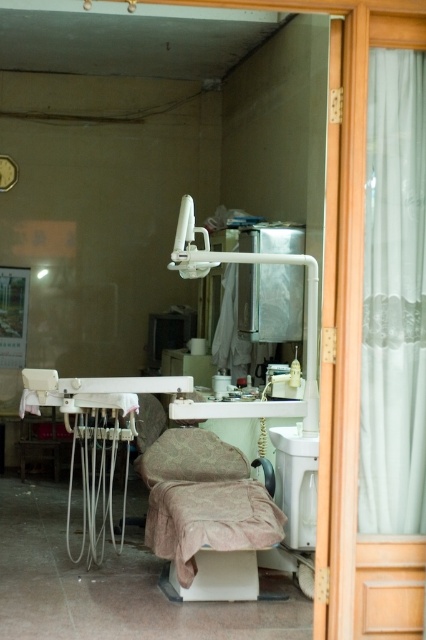
Question: Which object is farther from the camera taking this photo?

Choices:
 (A) white sheer curtain at right
 (B) pink fabric-covered chair at center

Answer: (B)

Question: Does white sheer curtain at right appear on the left side of pink fabric-covered chair at center?

Choices:
 (A) yes
 (B) no

Answer: (B)

Question: Which of the following is the farthest from the observer?

Choices:
 (A) pink fabric-covered chair at center
 (B) white glossy sink at center
 (C) white sheer curtain at right

Answer: (B)

Question: Is white sheer curtain at right in front of white glossy sink at center?

Choices:
 (A) yes
 (B) no

Answer: (A)

Question: Which object is the closest to the pink fabric-covered chair at center?

Choices:
 (A) white sheer curtain at right
 (B) white glossy sink at center

Answer: (B)

Question: Can you confirm if white sheer curtain at right is bigger than white glossy sink at center?

Choices:
 (A) yes
 (B) no

Answer: (B)